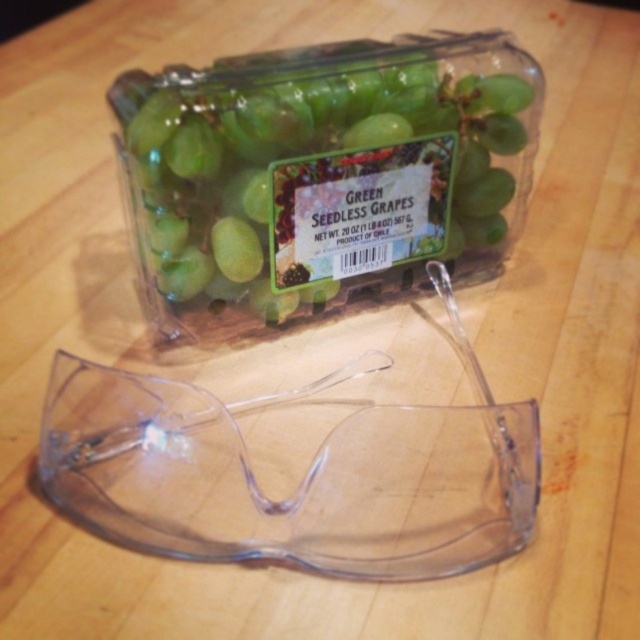
Can you confirm if green matte seedless grapes at upper center is positioned below transparent plastic goggles at center?

No.

Can you confirm if green matte seedless grapes at upper center is bigger than transparent plastic goggles at center?

No.

The width and height of the screenshot is (640, 640). What are the coordinates of `green matte seedless grapes at upper center` in the screenshot? It's located at (324, 170).

I want to click on green matte seedless grapes at upper center, so click(x=324, y=170).